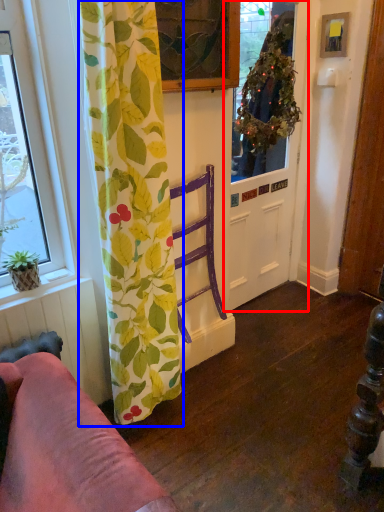
Question: Which object appears closest to the camera in this image, door (highlighted by a red box) or curtain (highlighted by a blue box)?

Choices:
 (A) door
 (B) curtain

Answer: (B)